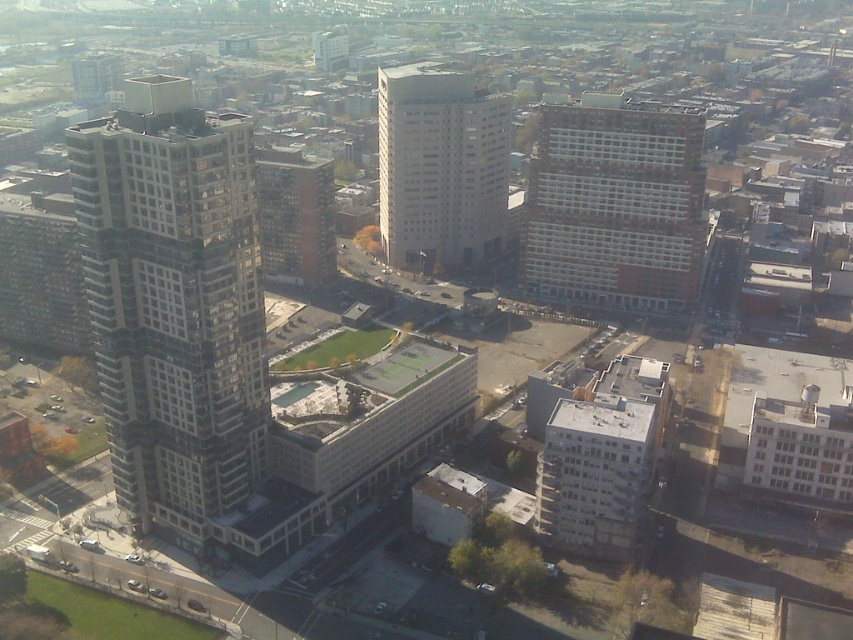
Question: Based on their relative distances, which object is nearer to the glassy gray skyscraper at left?

Choices:
 (A) white brick building at center
 (B) white glass building at center

Answer: (A)

Question: Is white brick building at center smaller than brown brick building at center?

Choices:
 (A) no
 (B) yes

Answer: (B)

Question: Is glassy gray skyscraper at left in front of white glass building at center?

Choices:
 (A) yes
 (B) no

Answer: (A)

Question: Where is glassy gray skyscraper at left located in relation to brown brick building at center in the image?

Choices:
 (A) above
 (B) below

Answer: (B)

Question: Which point appears farthest from the camera in this image?

Choices:
 (A) (587, 292)
 (B) (276, 266)
 (C) (248, 250)

Answer: (B)

Question: Which point is closer to the camera taking this photo?

Choices:
 (A) (259, 216)
 (B) (421, 128)
 (C) (84, 214)

Answer: (C)